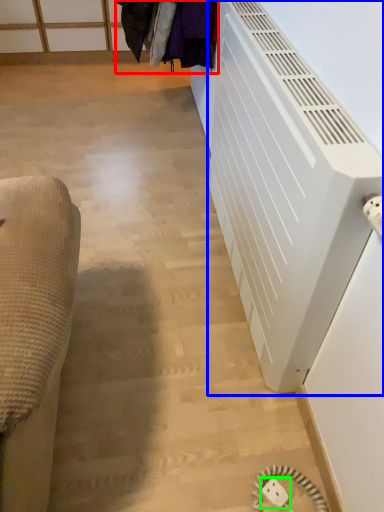
Question: Which object is the farthest from laundry (highlighted by a red box)? Choose among these: air conditioning (highlighted by a blue box) or electric outlet (highlighted by a green box).

Choices:
 (A) air conditioning
 (B) electric outlet

Answer: (B)